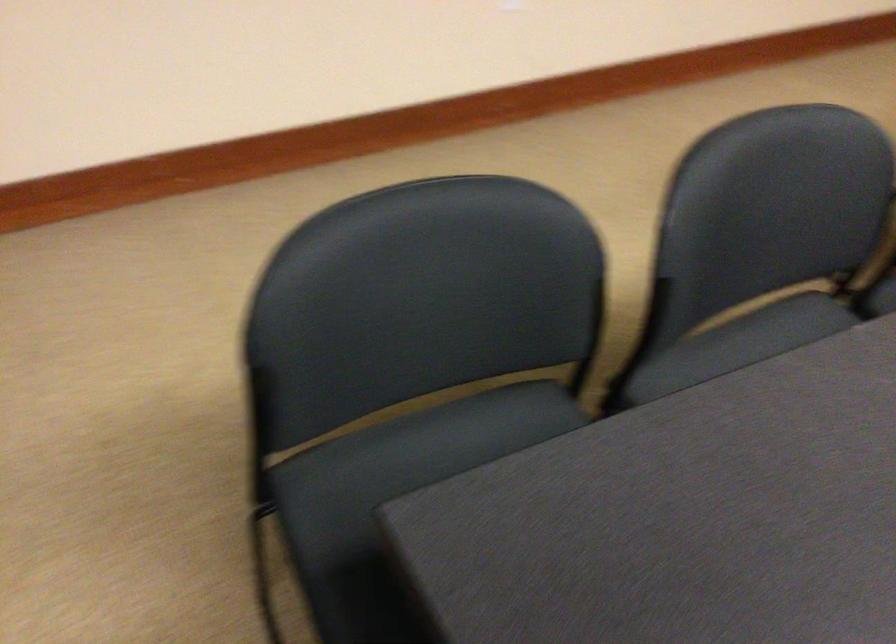
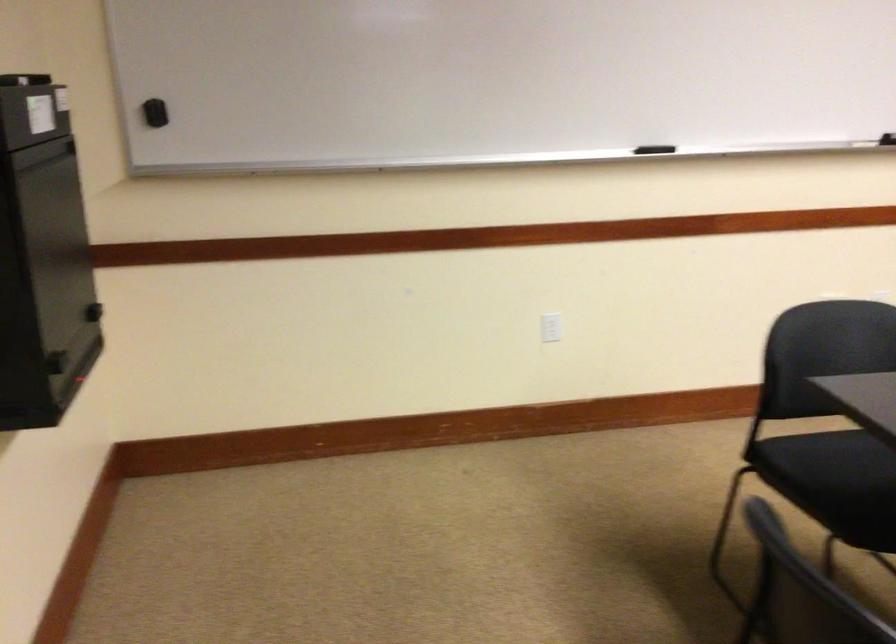
First-person continuous shooting, in which direction is the camera rotating?

The camera's rotation is toward right-down.